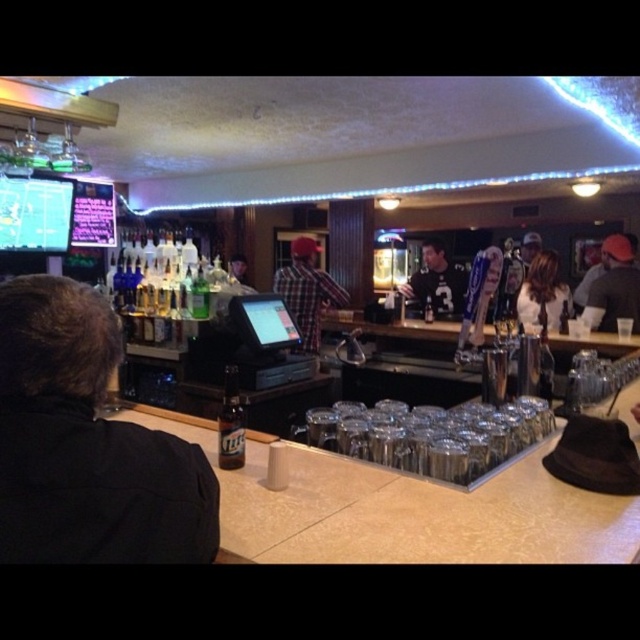
Which of these two, black leather jacket at left or matte black shirt at center, stands shorter?

With less height is black leather jacket at left.

Is black leather jacket at left thinner than matte black shirt at center?

Yes.

Between point (195, 529) and point (410, 276), which one is positioned behind?

The point (410, 276) is more distant.

You are a GUI agent. You are given a task and a screenshot of the screen. Output one action in this format:
    pyautogui.click(x=<x>, y=<y>)
    Task: Click on the black leather jacket at left
    
    Given the screenshot: What is the action you would take?
    pyautogui.click(x=86, y=444)

Is point (625, 273) positioned in front of point (228, 445)?

No, it is not.

Between point (605, 292) and point (221, 410), which one is positioned in front?

Positioned in front is point (221, 410).

Is point (588, 317) closer to viewer compared to point (220, 413)?

No, it is behind (220, 413).

Identify the location of dark gray knit cap at right. The height and width of the screenshot is (640, 640). (612, 288).

Can you confirm if dark gray knit cap at right is wider than matte black shirt at center?

In fact, dark gray knit cap at right might be narrower than matte black shirt at center.

What are the coordinates of `dark gray knit cap at right` in the screenshot? It's located at click(612, 288).

Locate an element on the screen. The height and width of the screenshot is (640, 640). dark gray knit cap at right is located at coordinates (612, 288).